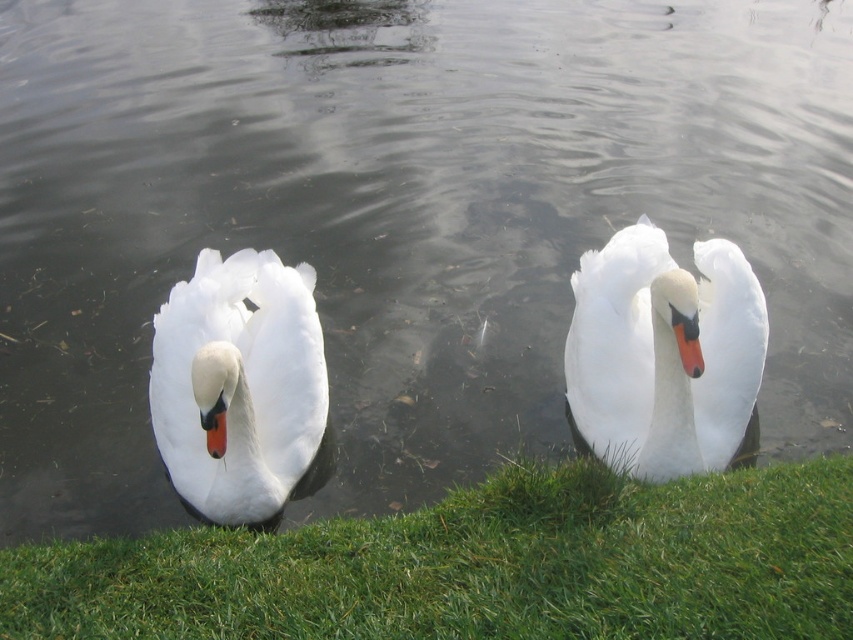
Consider the image. Can you confirm if green grass at lower center is wider than white glossy swan at center?

Indeed, green grass at lower center has a greater width compared to white glossy swan at center.

Which is more to the left, green grass at lower center or white glossy swan at center?

green grass at lower center

The height and width of the screenshot is (640, 853). In order to click on green grass at lower center in this screenshot , I will do `click(479, 564)`.

Is point (585, 320) less distant than point (299, 304)?

That is False.

Between white glossy swan at center and white glossy swan at left, which one has less height?

white glossy swan at center is shorter.

Image resolution: width=853 pixels, height=640 pixels. What do you see at coordinates (663, 353) in the screenshot?
I see `white glossy swan at center` at bounding box center [663, 353].

The width and height of the screenshot is (853, 640). In order to click on white glossy swan at center in this screenshot , I will do `click(663, 353)`.

Which is in front, point (80, 628) or point (194, 360)?

Point (80, 628)

At what (x,y) coordinates should I click in order to perform the action: click on green grass at lower center. Please return your answer as a coordinate pair (x, y). This screenshot has height=640, width=853. Looking at the image, I should click on (479, 564).

Locate an element on the screen. This screenshot has width=853, height=640. green grass at lower center is located at coordinates (479, 564).

You are a GUI agent. You are given a task and a screenshot of the screen. Output one action in this format:
    pyautogui.click(x=<x>, y=<y>)
    Task: Click on the green grass at lower center
    The height and width of the screenshot is (640, 853).
    Given the screenshot: What is the action you would take?
    pyautogui.click(x=479, y=564)